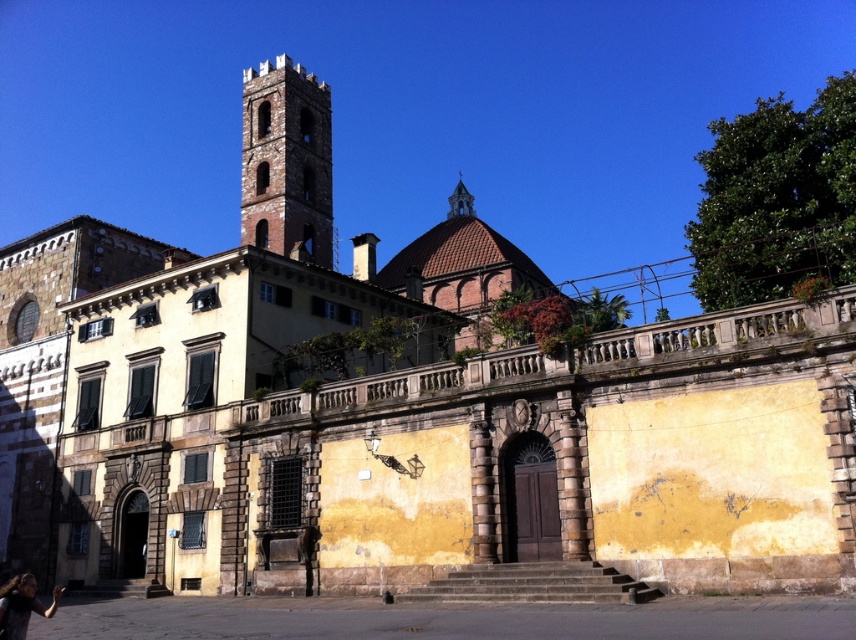
Question: Can you confirm if brown brick bell tower at upper left is positioned to the right of dark hair at lower left?

Choices:
 (A) yes
 (B) no

Answer: (B)

Question: Can you confirm if brown brick bell tower at upper left is thinner than dark hair at lower left?

Choices:
 (A) yes
 (B) no

Answer: (B)

Question: Does brown brick bell tower at upper left appear under dark hair at lower left?

Choices:
 (A) yes
 (B) no

Answer: (B)

Question: Which point is farther from the camera taking this photo?

Choices:
 (A) (321, 211)
 (B) (28, 586)

Answer: (A)

Question: Which object appears farthest from the camera in this image?

Choices:
 (A) brown brick bell tower at upper left
 (B) dark hair at lower left

Answer: (A)